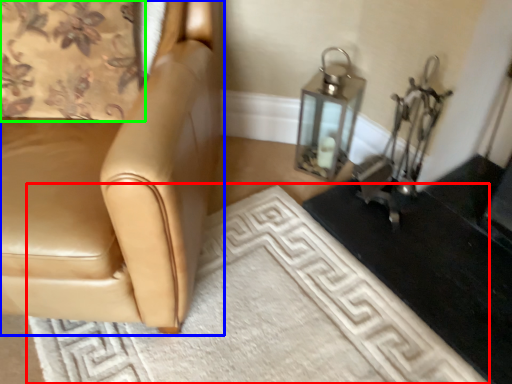
Question: Which object is the closest to the doormat (highlighted by a red box)? Choose among these: chair (highlighted by a blue box) or curtain (highlighted by a green box).

Choices:
 (A) chair
 (B) curtain

Answer: (A)